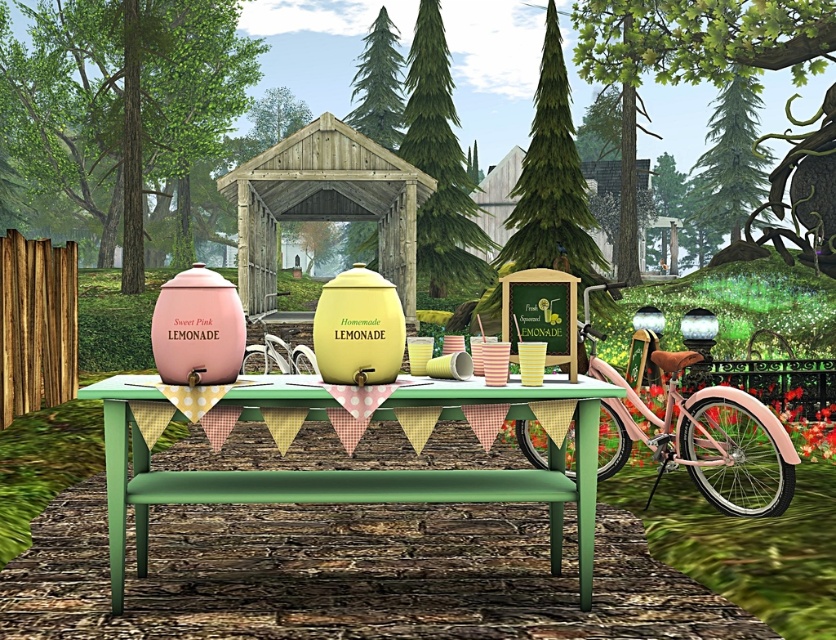
Question: Does pink matte bicycle at right have a smaller size compared to wooden hut at center?

Choices:
 (A) yes
 (B) no

Answer: (A)

Question: Considering the real-world distances, which object is closest to the wooden gazebo at center?

Choices:
 (A) pink matte bicycle at right
 (B) wooden hut at center

Answer: (A)

Question: Which object is closer to the camera taking this photo?

Choices:
 (A) wooden hut at center
 (B) pink matte bicycle at right

Answer: (B)

Question: Which of the following is the closest to the observer?

Choices:
 (A) (145, 388)
 (B) (745, 497)
 (C) (301, 156)
 (D) (610, 177)

Answer: (A)

Question: Does green wooden table at center have a greater width compared to pink matte bicycle at right?

Choices:
 (A) yes
 (B) no

Answer: (A)

Question: From the image, what is the correct spatial relationship of green wooden table at center in relation to wooden gazebo at center?

Choices:
 (A) below
 (B) above

Answer: (A)